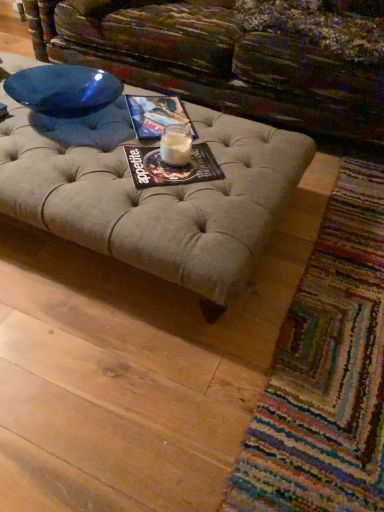
In order to click on vacant space in front of white glass candle at center in this screenshot , I will do `click(173, 173)`.